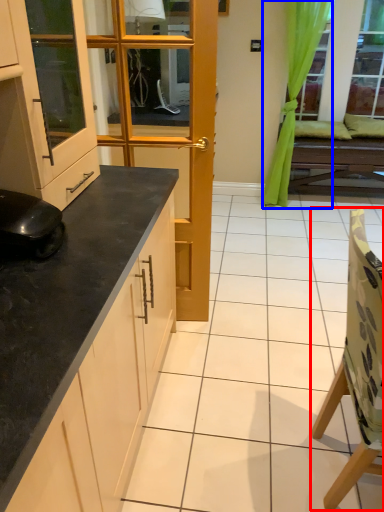
Question: Which object appears farthest to the camera in this image, chair (highlighted by a red box) or curtain (highlighted by a blue box)?

Choices:
 (A) chair
 (B) curtain

Answer: (B)